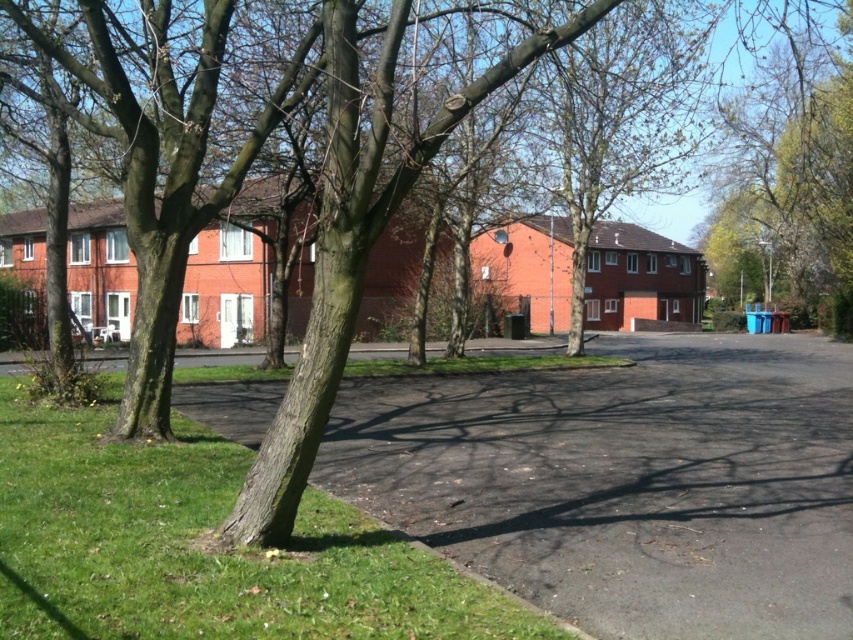
Question: Is green grass at lower left thinner than green leafy tree at right?

Choices:
 (A) no
 (B) yes

Answer: (B)

Question: Is the position of green grass at lower left less distant than that of green leafy tree at right?

Choices:
 (A) yes
 (B) no

Answer: (A)

Question: Can you confirm if green grass at lower left is positioned above green leafy tree at right?

Choices:
 (A) no
 (B) yes

Answer: (A)

Question: Which object appears farthest from the camera in this image?

Choices:
 (A) green leafy tree at right
 (B) green grass at lower left

Answer: (A)